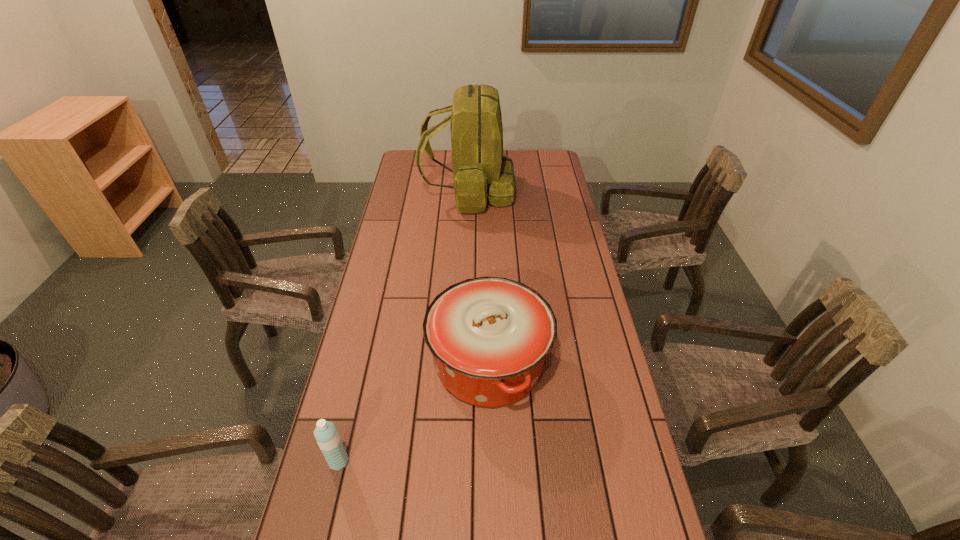
Find the location of a particular element. The image size is (960, 540). vacant space that satisfies the following two spatial constraints: 1. on the front-facing side of the farthest object; 2. on the front side of the nearest object is located at coordinates (459, 462).

You are a GUI agent. You are given a task and a screenshot of the screen. Output one action in this format:
    pyautogui.click(x=<x>, y=<y>)
    Task: Click on the vacant space that satisfies the following two spatial constraints: 1. on the front-facing side of the second shortest object; 2. on the right side of the farthest object
    
    Given the screenshot: What is the action you would take?
    pyautogui.click(x=462, y=363)

Where is `free location that satisfies the following two spatial constraints: 1. on the front-facing side of the backpack; 2. on the back side of the casserole`? This screenshot has width=960, height=540. free location that satisfies the following two spatial constraints: 1. on the front-facing side of the backpack; 2. on the back side of the casserole is located at coordinates (462, 363).

Find the location of a particular element. The width and height of the screenshot is (960, 540). vacant point that satisfies the following two spatial constraints: 1. on the front-facing side of the farthest object; 2. on the left side of the second farthest object is located at coordinates (x=462, y=363).